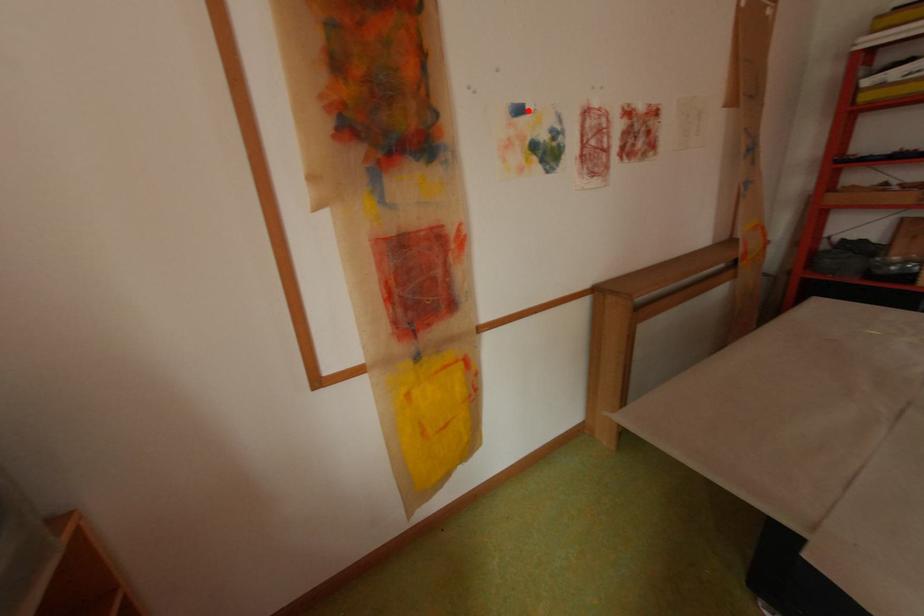
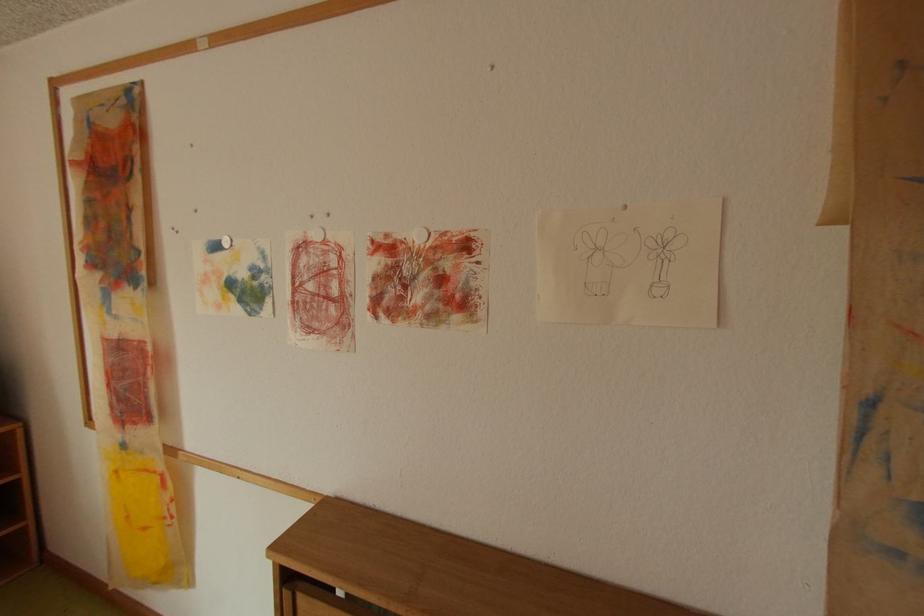
In the second image, find the point that corresponds to the highlighted location in the first image.

(225, 246)